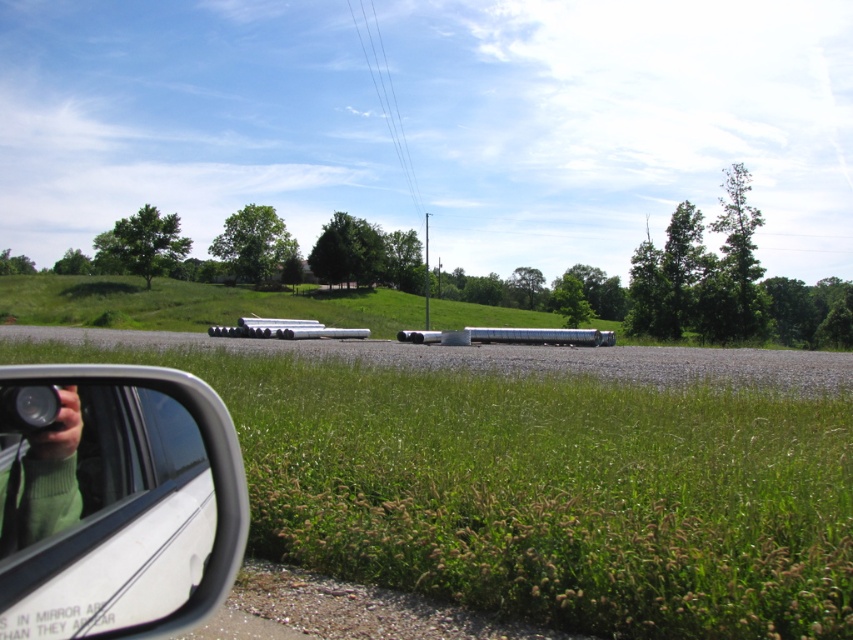
You are a photographer standing in front of the white glossy rearview mirror at lower left and the green sweater at lower left. You want to place a small decorative item between them so it can be seen clearly in both reflections. Considering their heights, will the item need to be placed higher or lower to be visible in both reflections?

The white glossy rearview mirror at lower left is shorter than the green sweater at lower left. To ensure the small decorative item is visible in both reflections, it should be placed at a height that is lower than the top of the mirror but still above the base of the sweater. This way, the item will be within the reflective field of both objects.

You are driving a car and need to check your blind spot. The white glossy rearview mirror at lower left is located at point 0.783, 0.135. Is this mirror positioned to give a clear view of the road behind you?

The white glossy rearview mirror at lower left is positioned at point (x=114, y=500), which is in the lower left area of the vehicle. This position typically allows drivers to monitor the road behind but may not fully cover the blind spots, so additional side mirrors or head checks are recommended for safety.